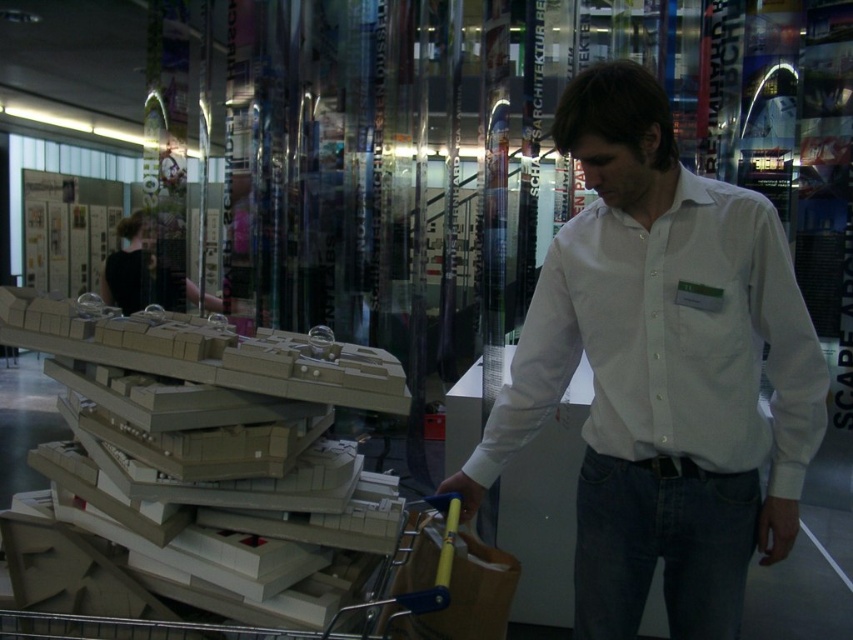
You are standing at the entrance of the gallery and want to approach the man wearing the white cotton shirt at center. If you walk straight ahead, will you reach him directly or will you need to navigate around the trolley with architectural models?

Since the white cotton shirt at center is positioned at point (662, 371), walking straight ahead from the entrance would lead you directly to him without needing to navigate around the trolley with architectural models.

You are standing in an exhibition space and see the white cotton shirt at center. If you want to take a photo of it with your phone, which is 0.5 feet long, will the shirt be within the recommended 4 feet focus range of your phone?

The white cotton shirt at center is 4.48 feet away from the camera, which is slightly beyond the recommended 4 feet focus range. Therefore, the shirt may not be in focus if you take the photo from this distance.

You are standing in front of the trolley with architectural models. There are two points marked on the models, one at coordinate point (x=653, y=259) and another at point (x=223, y=568). If you want to reach the point closer to you, which coordinate should you aim for?

Point (x=223, y=568) is closer to you than point (x=653, y=259), so you should aim for point (x=223, y=568).